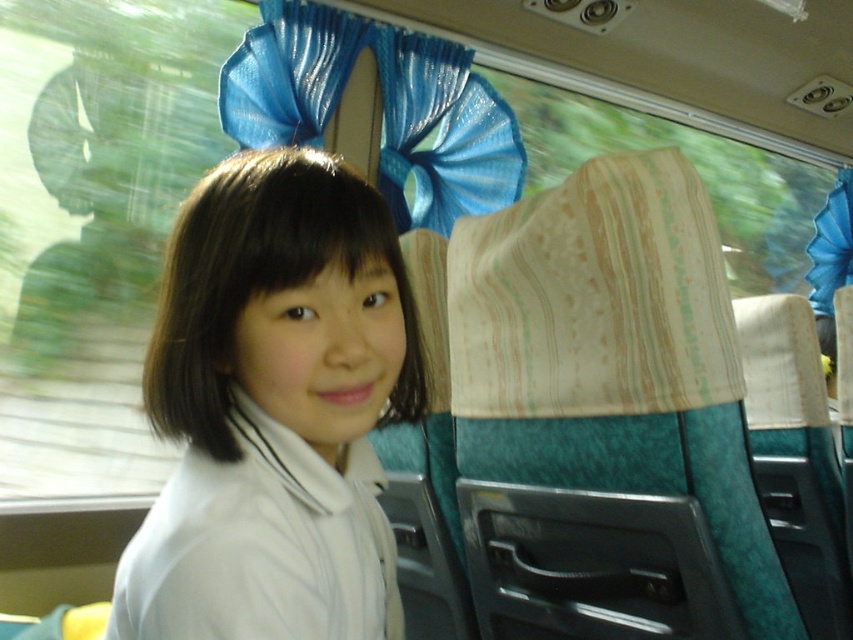
You are a passenger on the bus and want to place your phone on the white fabric at center. Your phone is 6 inches long. Will it fit?

The white fabric at center is 17.61 inches from viewer, so the phone will fit as the distance is sufficient.

You are a passenger in a moving vehicle and want to place a rectangular box on the seat. The box is 1 meter wide. Can you fit it on the white fabric at center without overlapping the shiny blue fabric at upper center?

The white fabric at center has a width less than the shiny blue fabric at upper center. Since the box is 1 meter wide, you need to check if the white fabric at center is wide enough. However, since the white fabric at center is narrower than the shiny blue fabric at upper center, but we don not know the exact width of the white fabric. Therefore, it is uncertain if the box will fit without overlapping.

You are a passenger on a moving bus or train and notice two fabrics in the scene. The first is the white fabric at center, and the second is the shiny blue fabric at upper center. Which fabric is positioned higher up in the scene?

The shiny blue fabric at upper center is positioned higher up in the scene than the white fabric at center.